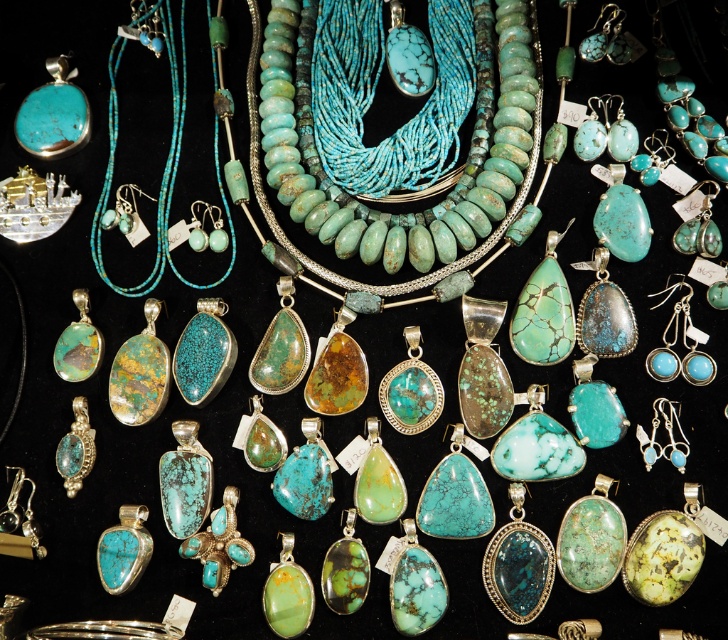
Question: Does turquoise stone beads at center come behind turquoise beads at upper left?

Choices:
 (A) no
 (B) yes

Answer: (A)

Question: Does turquoise stone beads at center lie in front of turquoise beads at upper left?

Choices:
 (A) no
 (B) yes

Answer: (B)

Question: Is the position of turquoise stone beads at center more distant than that of turquoise beads at upper left?

Choices:
 (A) yes
 (B) no

Answer: (B)